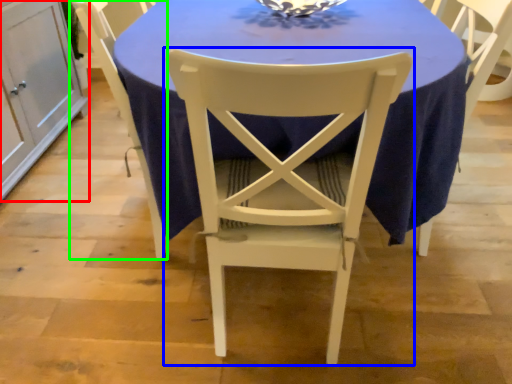
Question: Which is farther away from cabinetry (highlighted by a red box)? chair (highlighted by a blue box) or chair (highlighted by a green box)?

Choices:
 (A) chair
 (B) chair

Answer: (A)